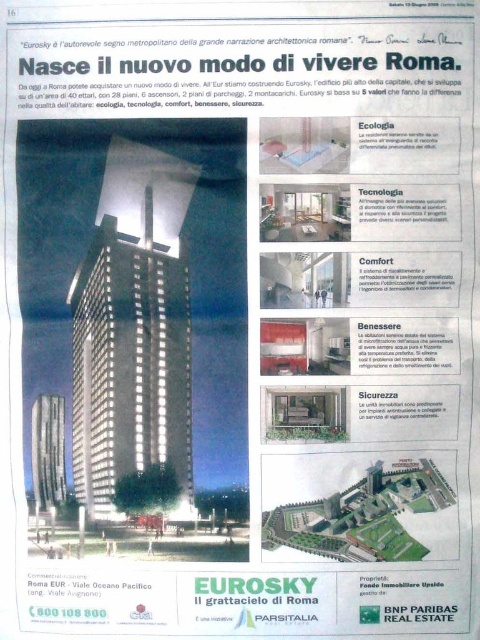
Question: Which point appears closest to the camera in this image?

Choices:
 (A) (162, 432)
 (B) (47, 476)

Answer: (B)

Question: Which point is closer to the camera?

Choices:
 (A) (39, 460)
 (B) (171, 440)

Answer: (B)

Question: Among these objects, which one is farthest from the camera?

Choices:
 (A) matte glass skyscraper at center
 (B) silver metallic tower at center

Answer: (B)

Question: From the image, what is the correct spatial relationship of matte glass skyscraper at center in relation to silver metallic tower at center?

Choices:
 (A) left
 (B) right

Answer: (B)

Question: Is matte glass skyscraper at center closer to camera compared to silver metallic tower at center?

Choices:
 (A) yes
 (B) no

Answer: (A)

Question: Does matte glass skyscraper at center appear under silver metallic tower at center?

Choices:
 (A) no
 (B) yes

Answer: (A)